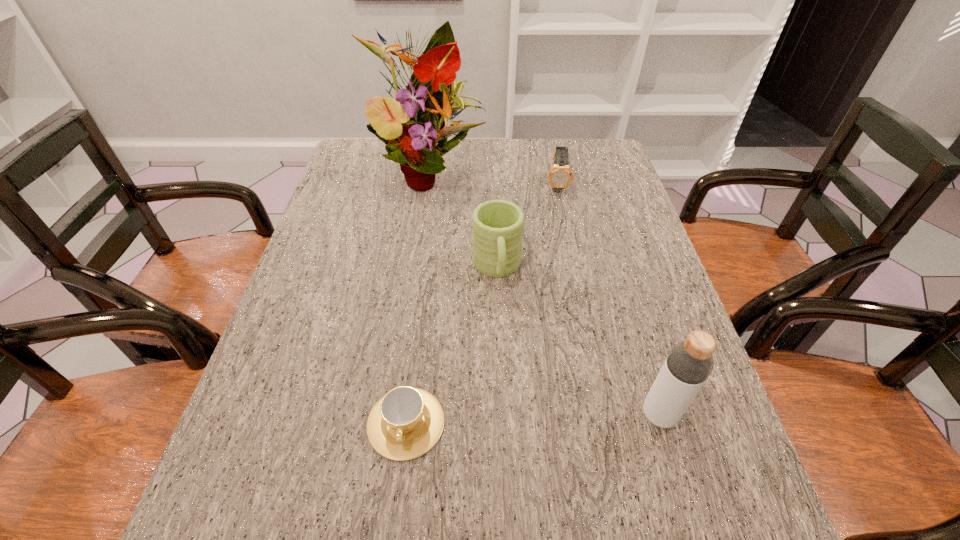
Where is `vacant space located 0.100m on the face of the second object from right to left`? Image resolution: width=960 pixels, height=540 pixels. vacant space located 0.100m on the face of the second object from right to left is located at coordinates (560, 217).

Image resolution: width=960 pixels, height=540 pixels. I want to click on free spot located on the face of the second object from right to left, so click(x=563, y=271).

Find the location of `free space located 0.270m on the side of the third tallest object with the handle`. free space located 0.270m on the side of the third tallest object with the handle is located at coordinates (513, 399).

Locate an element on the screen. free space located 0.050m on the side of the third tallest object with the handle is located at coordinates (502, 312).

Identify the location of vacant point located on the side of the third tallest object with the handle. (519, 454).

Locate an element on the screen. The image size is (960, 540). vacant space situated 0.160m on the front-facing side of the tallest object is located at coordinates (461, 234).

You are a GUI agent. You are given a task and a screenshot of the screen. Output one action in this format:
    pyautogui.click(x=<x>, y=<y>)
    Task: Click on the vacant space located on the front-facing side of the tallest object
    
    Given the screenshot: What is the action you would take?
    pyautogui.click(x=484, y=285)

This screenshot has width=960, height=540. I want to click on free spot located on the front-facing side of the tallest object, so click(470, 256).

Identify the location of watch located in the far edge section of the desktop. (560, 176).

This screenshot has width=960, height=540. What are the coordinates of `bouquet that is at the far edge` in the screenshot? It's located at (420, 116).